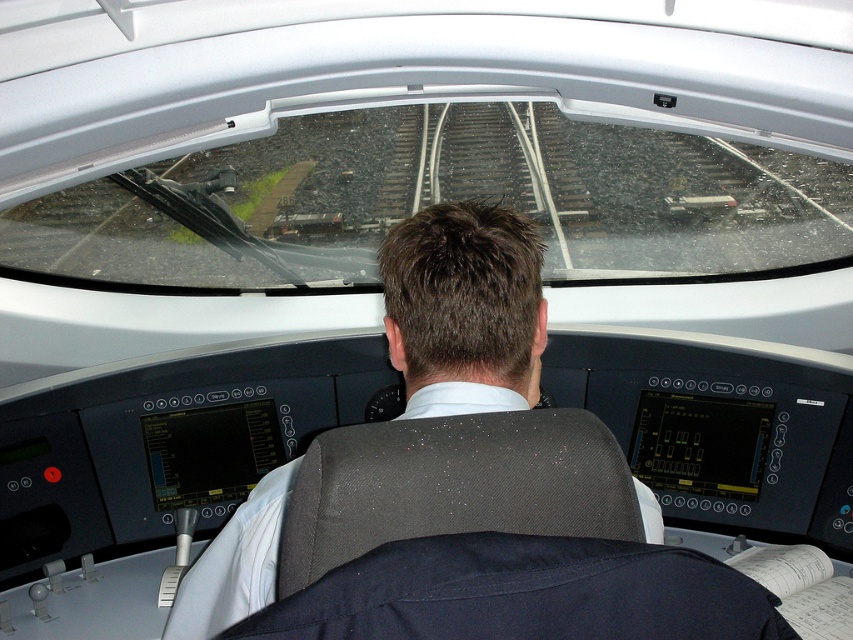
You are a passenger in the train and want to touch the dark blue fabric at center. Which direction should you move your hand from your current position at point (x=523, y=593)?

The dark blue fabric at center is located at point (x=523, y=593), so you don not need to move your hand from your current position to touch it.

You are a train inspector checking the cockpit. You notice two fabrics at the center of the cockpit, a dark blue fabric at center and a dark gray fabric at center. Which fabric is positioned closer to you?

The dark blue fabric at center is closer to the viewer than the dark gray fabric at center.

Based on the photo, you are a maintenance technician working on the train cockpit. You need to reach a point at coordinate point [527,573]. Can you safely reach it while standing in the cockpit?

The point at coordinate point [527,573] is 23.93 inches from the camera, so yes, you can safely reach it while standing in the cockpit since it is within a comfortable reach distance.